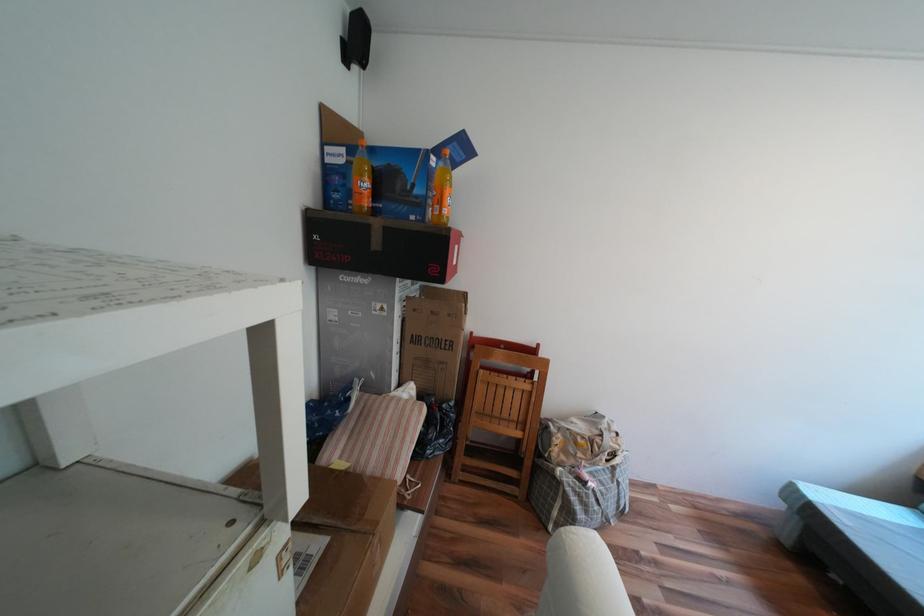
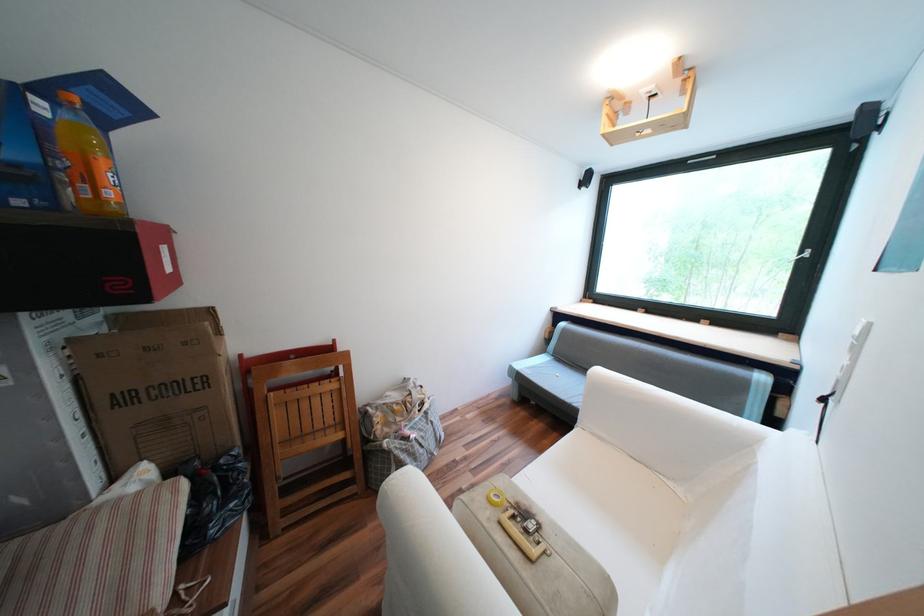
Where in the second image is the point corresponding to point 524,378 from the first image?

(325, 383)